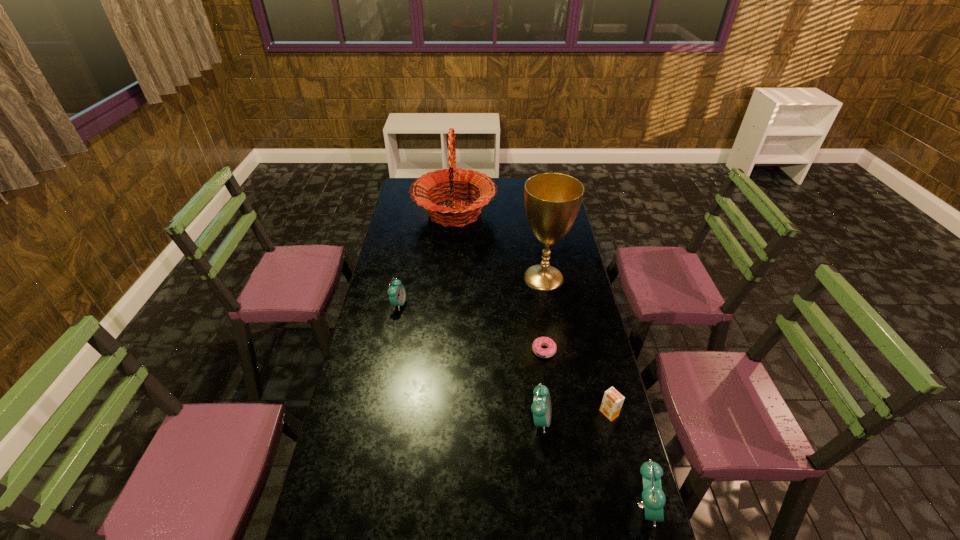
Where is `the fifth nearest object`? The height and width of the screenshot is (540, 960). the fifth nearest object is located at coordinates (397, 294).

The image size is (960, 540). In order to click on the farthest alarm clock in this screenshot , I will do `click(397, 294)`.

Find the location of a particular element. The width and height of the screenshot is (960, 540). the fourth tallest object is located at coordinates click(x=541, y=407).

Identify the location of the second shortest alarm clock. This screenshot has height=540, width=960. (541, 407).

You are a GUI agent. You are given a task and a screenshot of the screen. Output one action in this format:
    pyautogui.click(x=<x>, y=<y>)
    Task: Click on the rightmost alarm clock
    
    Given the screenshot: What is the action you would take?
    pyautogui.click(x=653, y=497)

You are a GUI agent. You are given a task and a screenshot of the screen. Output one action in this format:
    pyautogui.click(x=<x>, y=<y>)
    Task: Click on the nearest alarm clock
    Image resolution: width=960 pixels, height=540 pixels.
    Given the screenshot: What is the action you would take?
    653,497

Where is `the farthest object`? the farthest object is located at coordinates pos(474,181).

You are a GUI agent. You are given a task and a screenshot of the screen. Output one action in this format:
    pyautogui.click(x=<x>, y=<y>)
    Task: Click on the fourth farthest object
    
    Given the screenshot: What is the action you would take?
    pyautogui.click(x=548, y=352)

Find the location of a particular element. The height and width of the screenshot is (540, 960). the shortest object is located at coordinates (548, 352).

Where is `trophy cup`? This screenshot has width=960, height=540. trophy cup is located at coordinates (552, 200).